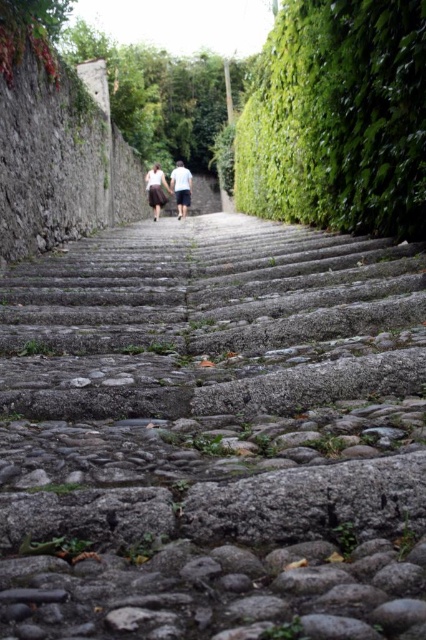
Question: Does gray stone stairs at center appear on the left side of green leafy hedge at right?

Choices:
 (A) yes
 (B) no

Answer: (A)

Question: Which of the following is the farthest from the observer?

Choices:
 (A) green leafy hedge at right
 (B) gray stone stairs at center
 (C) white cotton shirts at center

Answer: (C)

Question: Does gray stone stairs at center appear on the left side of white cotton shirts at center?

Choices:
 (A) yes
 (B) no

Answer: (B)

Question: Which object appears closest to the camera in this image?

Choices:
 (A) gray stone stairs at center
 (B) green leafy hedge at right
 (C) white cotton shirts at center
 (D) white cotton shirt at center

Answer: (A)

Question: Estimate the real-world distances between objects in this image. Which object is farther from the white cotton shirt at center?

Choices:
 (A) white cotton shirts at center
 (B) gray stone stairs at center

Answer: (B)

Question: Is gray stone stairs at center positioned behind green leafy hedge at right?

Choices:
 (A) no
 (B) yes

Answer: (A)